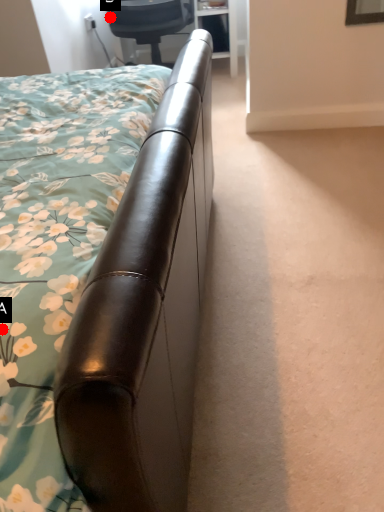
Question: Two points are circled on the image, labeled by A and B beside each circle. Among these points, which one is farthest from the camera?

Choices:
 (A) A is further
 (B) B is further

Answer: (B)